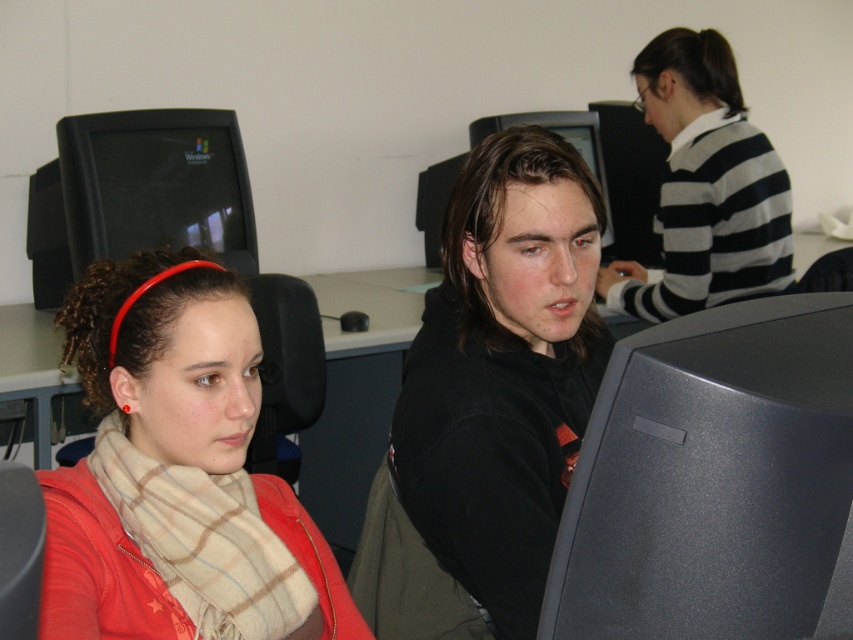
Question: Among these objects, which one is nearest to the camera?

Choices:
 (A) black matte monitor at upper left
 (B) striped sweater at upper right
 (C) matte black monitor at center

Answer: (C)

Question: Can you confirm if matte black monitor at center is smaller than black matte jacket at center?

Choices:
 (A) yes
 (B) no

Answer: (A)

Question: Can you confirm if plaid scarf at center is wider than black glossy monitor at center?

Choices:
 (A) yes
 (B) no

Answer: (B)

Question: Among these points, which one is nearest to the camera?

Choices:
 (A) (187, 234)
 (B) (138, 316)

Answer: (B)

Question: Is plaid scarf at center to the left of black matte jacket at center from the viewer's perspective?

Choices:
 (A) no
 (B) yes

Answer: (B)

Question: Which object appears farthest from the camera in this image?

Choices:
 (A) plaid scarf at center
 (B) black matte jacket at center
 (C) matte black monitor at center

Answer: (B)